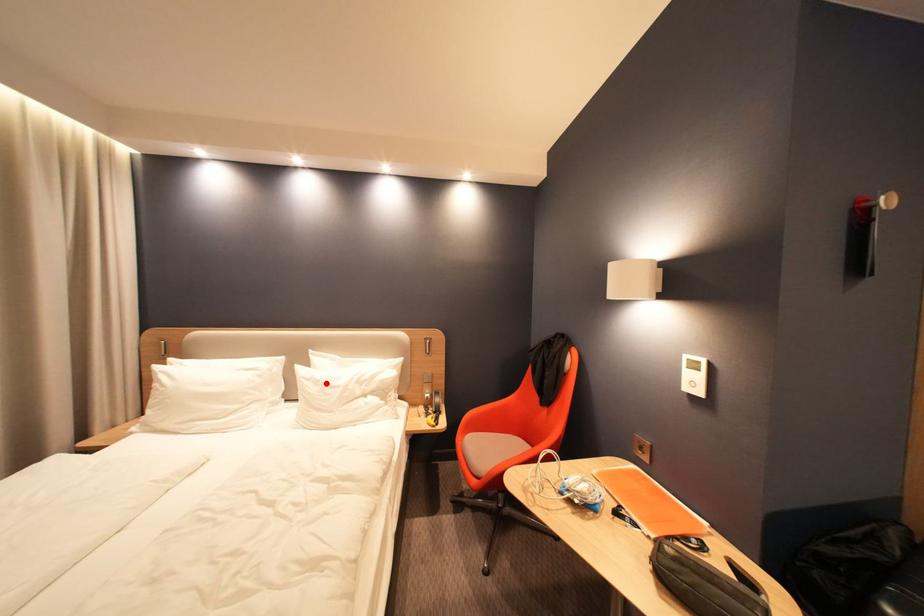
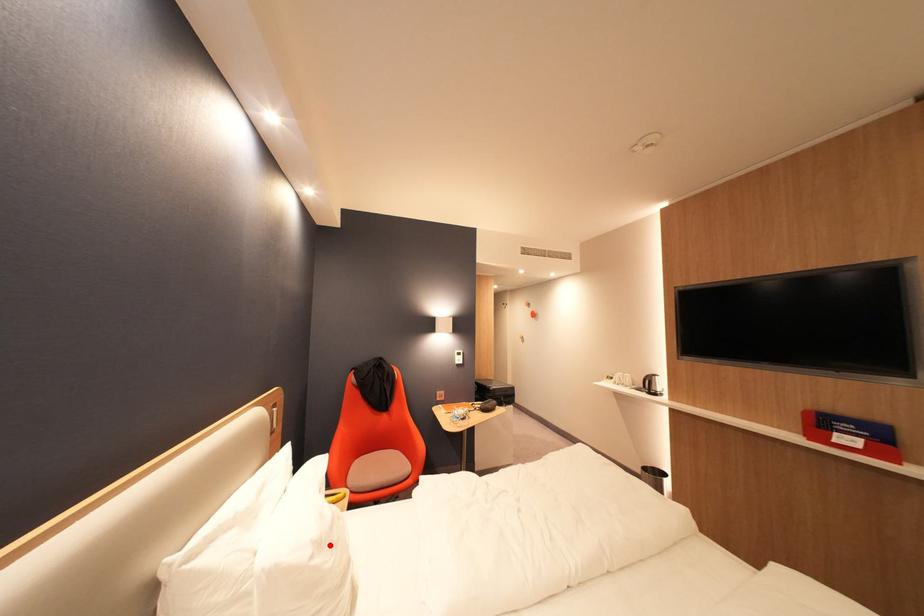
I am providing you with two images of the same scene from different viewpoints. A red point is marked on the first image and another point is marked on the second image. Is the marked point in image1 the same physical position as the marked point in image2?

Yes